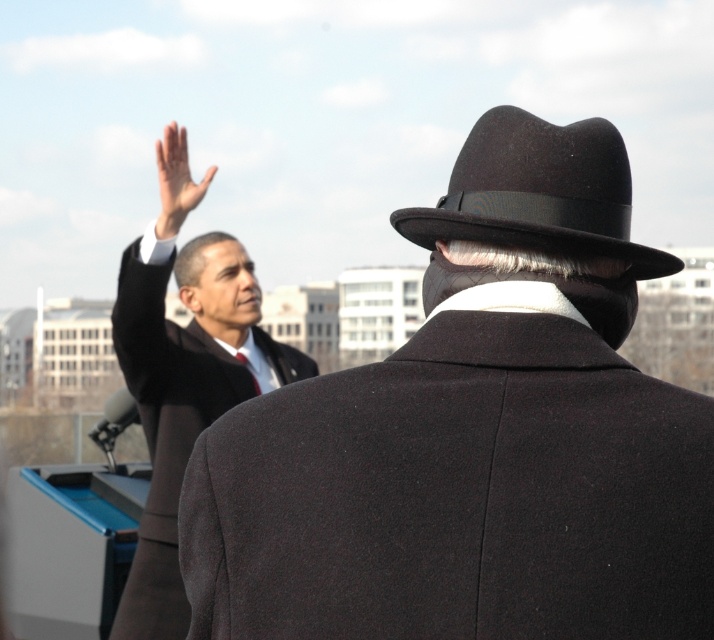
Question: Which is farther from the matte black hand at upper left?

Choices:
 (A) matte black suit at upper left
 (B) black felt fedora at upper right
 (C) matte black coat at center

Answer: (C)

Question: Is matte black coat at center thinner than matte black suit at upper left?

Choices:
 (A) no
 (B) yes

Answer: (B)

Question: Which object appears closest to the camera in this image?

Choices:
 (A) matte black suit at upper left
 (B) matte black coat at center
 (C) black felt fedora at upper right

Answer: (B)

Question: Is matte black coat at center below matte black suit at upper left?

Choices:
 (A) yes
 (B) no

Answer: (B)

Question: Which point appears closest to the camera in this image?

Choices:
 (A) (640, 266)
 (B) (176, 157)

Answer: (A)

Question: Can you confirm if matte black coat at center is positioned above matte black suit at upper left?

Choices:
 (A) yes
 (B) no

Answer: (A)